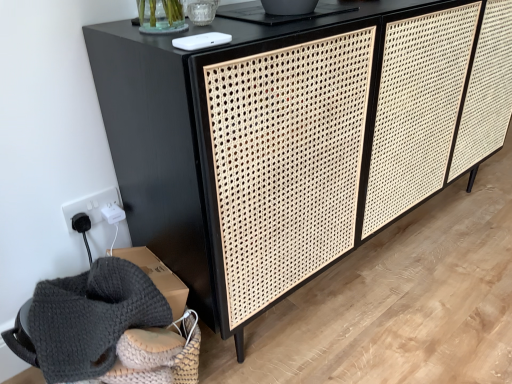
Describe the element at coordinates (91, 206) in the screenshot. I see `white plastic plug at lower left` at that location.

Find the location of a particular element. The width and height of the screenshot is (512, 384). white plastic plug at lower left is located at coordinates (91, 206).

Where is `white plastic plug at lower left`? Image resolution: width=512 pixels, height=384 pixels. white plastic plug at lower left is located at coordinates (91, 206).